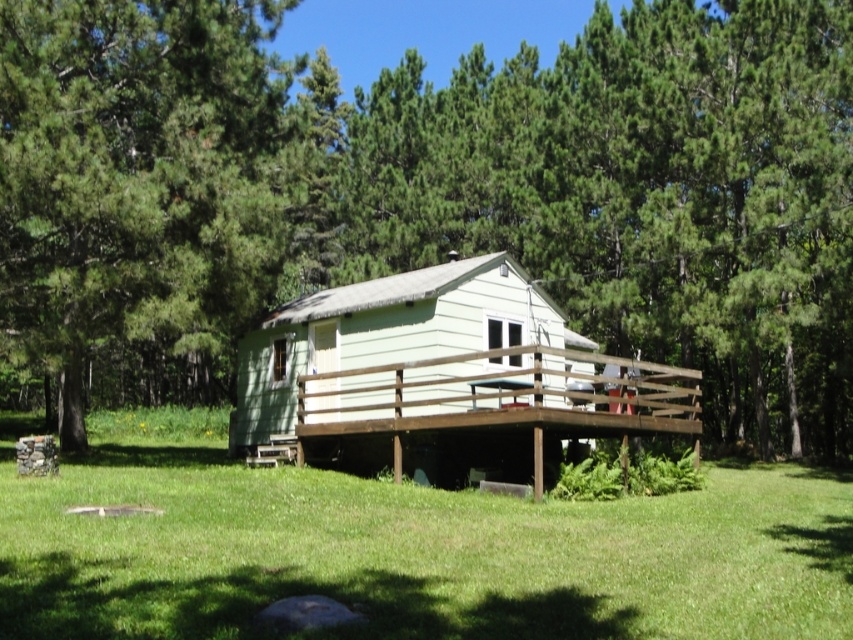
Looking at this image, does green leafy tree at center come in front of green grass at center?

That is False.

Does point (48, 269) come farther from viewer compared to point (329, 595)?

That is True.

What do you see at coordinates (434, 192) in the screenshot?
I see `green leafy tree at center` at bounding box center [434, 192].

Where is `green leafy tree at center`? green leafy tree at center is located at coordinates (434, 192).

The height and width of the screenshot is (640, 853). Identify the location of green textured tree at upper left. (135, 179).

Does green textured tree at upper left lie behind brown wooden deck at center?

Yes, green textured tree at upper left is behind brown wooden deck at center.

You are a GUI agent. You are given a task and a screenshot of the screen. Output one action in this format:
    pyautogui.click(x=<x>, y=<y>)
    Task: Click on the green textured tree at upper left
    This screenshot has width=853, height=640.
    Given the screenshot: What is the action you would take?
    pyautogui.click(x=135, y=179)

Image resolution: width=853 pixels, height=640 pixels. Find the location of `green textured tree at upper left`. green textured tree at upper left is located at coordinates (135, 179).

Locate an element on the screen. green leafy tree at center is located at coordinates click(x=434, y=192).

Which is in front, point (701, 81) or point (398, 449)?

Point (398, 449) is more forward.

Who is more forward, [161,218] or [314,387]?

Point [161,218]

Find the location of `green leafy tree at center`. green leafy tree at center is located at coordinates (434, 192).